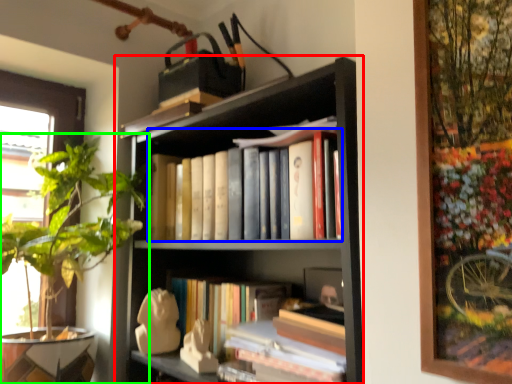
Question: Which is nearer to the bookcase (highlighted by a red box)? book (highlighted by a blue box) or houseplant (highlighted by a green box).

Choices:
 (A) book
 (B) houseplant

Answer: (A)